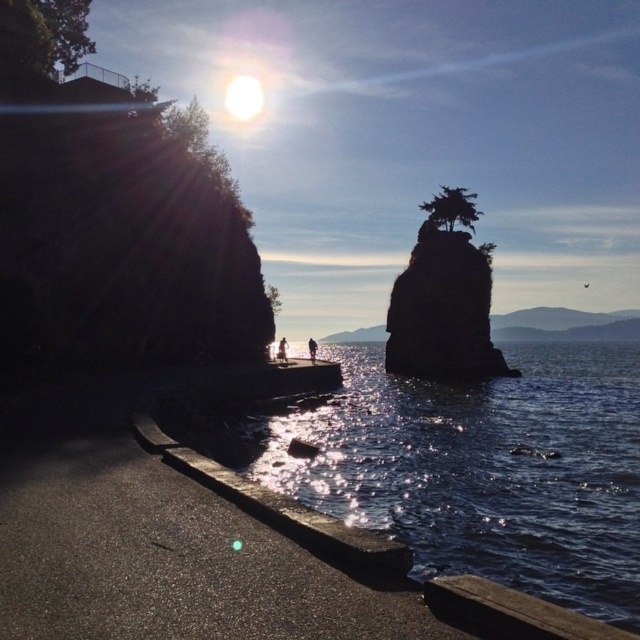
You are standing on the pathway and want to walk to the green matte tree at upper center. The path is 20 meters long. Can you reach the tree without walking through the glistening water at lower center?

The glistening water at lower center is 24.01 meters from the green matte tree at upper center. Since the path is only 20 meters long, you would have to walk beyond the path to reach the tree, which might require going through the water. Therefore, you cannot reach the tree without walking through the glistening water at lower center.

You are standing on the pathway and want to take a photo of the silhouette stone at center and the green matte tree at upper center. Which object should you focus on first to ensure both are in the frame?

You should focus on the silhouette stone at center first because it is closer to you than the green matte tree at upper center, ensuring both are in the frame.